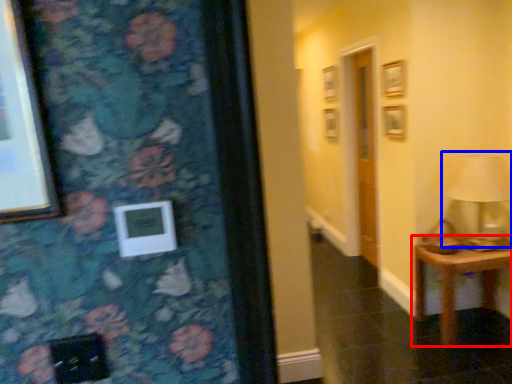
Question: Which of the following is the closest to the observer, table (highlighted by a red box) or table lamp (highlighted by a blue box)?

Choices:
 (A) table
 (B) table lamp

Answer: (B)